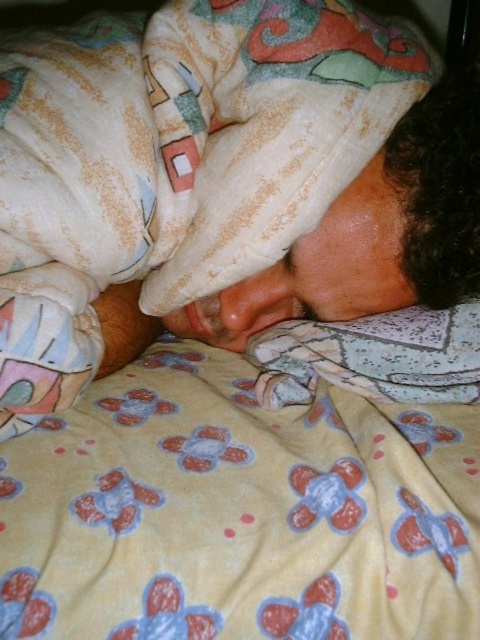
Question: Which point is closer to the camera?

Choices:
 (A) (45, 588)
 (B) (303, 342)

Answer: (A)

Question: Does yellow fleece blanket at lower center have a lesser width compared to fluffy white pillow at lower center?

Choices:
 (A) no
 (B) yes

Answer: (A)

Question: Where is yellow fleece blanket at lower center located in relation to fluffy white pillow at lower center in the image?

Choices:
 (A) below
 (B) above

Answer: (A)

Question: Is yellow fleece blanket at lower center to the right of fluffy white pillow at lower center from the viewer's perspective?

Choices:
 (A) no
 (B) yes

Answer: (A)

Question: Which of the following is the closest to the observer?

Choices:
 (A) fluffy white pillow at lower center
 (B) yellow fleece blanket at lower center

Answer: (B)